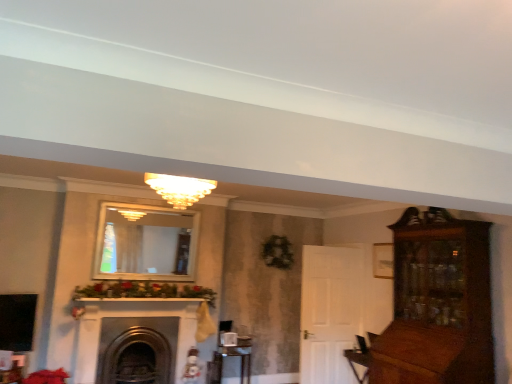
Question: From a real-world perspective, relative to matte glass chandelier at center, is dark gray stone fireplace at center vertically above or below?

Choices:
 (A) below
 (B) above

Answer: (A)

Question: Is dark gray stone fireplace at center in front of or behind matte glass chandelier at center in the image?

Choices:
 (A) front
 (B) behind

Answer: (B)

Question: Considering the real-world distances, which object is farthest from the dark gray stone fireplace at center?

Choices:
 (A) metallic silver table at lower center
 (B) matte glass chandelier at center

Answer: (B)

Question: Which is nearer to the metallic silver table at lower center?

Choices:
 (A) matte glass chandelier at center
 (B) dark gray stone fireplace at center

Answer: (B)